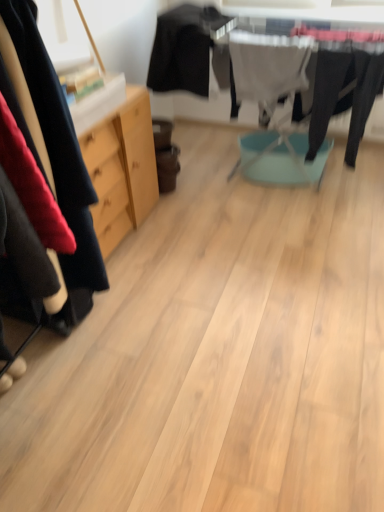
Question: In the image, is black fabric at upper center, the second clothing positioned from the right, on the left side or the right side of white fabric at center, the first clothing when ordered from right to left?

Choices:
 (A) left
 (B) right

Answer: (A)

Question: From their relative heights in the image, would you say black fabric at upper center, the second clothing positioned from the right, is taller or shorter than white fabric at center, arranged as the second clothing when viewed from the left?

Choices:
 (A) short
 (B) tall

Answer: (A)

Question: Based on their sizes in the image, would you say black fabric at upper center, placed as the first clothing when sorted from left to right, is bigger or smaller than white fabric at center, the first clothing when ordered from right to left?

Choices:
 (A) small
 (B) big

Answer: (B)

Question: Does point (266, 117) appear closer or farther from the camera than point (205, 35)?

Choices:
 (A) closer
 (B) farther

Answer: (B)

Question: Would you say white fabric at center, the first clothing when ordered from right to left, is to the left or to the right of black fabric at upper center, placed as the first clothing when sorted from left to right, in the picture?

Choices:
 (A) right
 (B) left

Answer: (A)

Question: Looking at their shapes, would you say white fabric at center, arranged as the second clothing when viewed from the left, is wider or thinner than black fabric at upper center, the second clothing positioned from the right?

Choices:
 (A) thin
 (B) wide

Answer: (A)

Question: From the image's perspective, is white fabric at center, arranged as the second clothing when viewed from the left, located above or below black fabric at upper center, placed as the first clothing when sorted from left to right?

Choices:
 (A) above
 (B) below

Answer: (B)